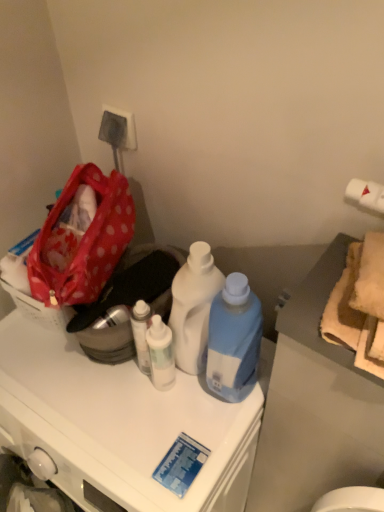
Question: From the image's perspective, is white plastic bottle at center, marked as the second bottle in a right-to-left arrangement, beneath white glossy bottle at center, which ranks as the 1th bottle in left-to-right order?

Choices:
 (A) no
 (B) yes

Answer: (A)

Question: Is white plastic bottle at center, acting as the second bottle starting from the left, to the left of white glossy bottle at center, which ranks as the 1th bottle in left-to-right order, from the viewer's perspective?

Choices:
 (A) yes
 (B) no

Answer: (B)

Question: Is white plastic bottle at center, marked as the second bottle in a right-to-left arrangement, to the right of white glossy bottle at center, acting as the 3th bottle starting from the right, from the viewer's perspective?

Choices:
 (A) no
 (B) yes

Answer: (B)

Question: Can you confirm if white plastic bottle at center, acting as the second bottle starting from the left, is taller than white glossy bottle at center, which ranks as the 1th bottle in left-to-right order?

Choices:
 (A) no
 (B) yes

Answer: (B)

Question: Is white glossy bottle at center, which ranks as the 1th bottle in left-to-right order, located within white plastic bottle at center, marked as the second bottle in a right-to-left arrangement?

Choices:
 (A) yes
 (B) no

Answer: (B)

Question: Considering the positions of point (153, 333) and point (122, 476), is point (153, 333) closer or farther from the camera than point (122, 476)?

Choices:
 (A) farther
 (B) closer

Answer: (A)

Question: Is white glossy bottle at center, which ranks as the 1th bottle in left-to-right order, in front of or behind white glossy cabinet at center in the image?

Choices:
 (A) front
 (B) behind

Answer: (B)

Question: From a real-world perspective, is white glossy bottle at center, which ranks as the 1th bottle in left-to-right order, physically located above or below white glossy cabinet at center?

Choices:
 (A) below
 (B) above

Answer: (B)

Question: Would you say white glossy bottle at center, acting as the 3th bottle starting from the right, is to the left or to the right of white glossy cabinet at center in the picture?

Choices:
 (A) left
 (B) right

Answer: (B)

Question: Is red polka dot fabric bag at left inside the boundaries of polka dot fabric picnic basket at left, or outside?

Choices:
 (A) outside
 (B) inside

Answer: (A)

Question: Is red polka dot fabric bag at left in front of or behind polka dot fabric picnic basket at left in the image?

Choices:
 (A) behind
 (B) front

Answer: (B)

Question: Based on their positions, is red polka dot fabric bag at left located to the left or right of polka dot fabric picnic basket at left?

Choices:
 (A) left
 (B) right

Answer: (B)

Question: Considering the positions of red polka dot fabric bag at left and polka dot fabric picnic basket at left in the image, is red polka dot fabric bag at left wider or thinner than polka dot fabric picnic basket at left?

Choices:
 (A) thin
 (B) wide

Answer: (B)

Question: Looking at their shapes, would you say white glossy bottle at center, acting as the 3th bottle starting from the right, is wider or thinner than red polka dot fabric bag at left?

Choices:
 (A) wide
 (B) thin

Answer: (B)

Question: Looking at the image, does white glossy bottle at center, which ranks as the 1th bottle in left-to-right order, seem bigger or smaller compared to red polka dot fabric bag at left?

Choices:
 (A) big
 (B) small

Answer: (B)